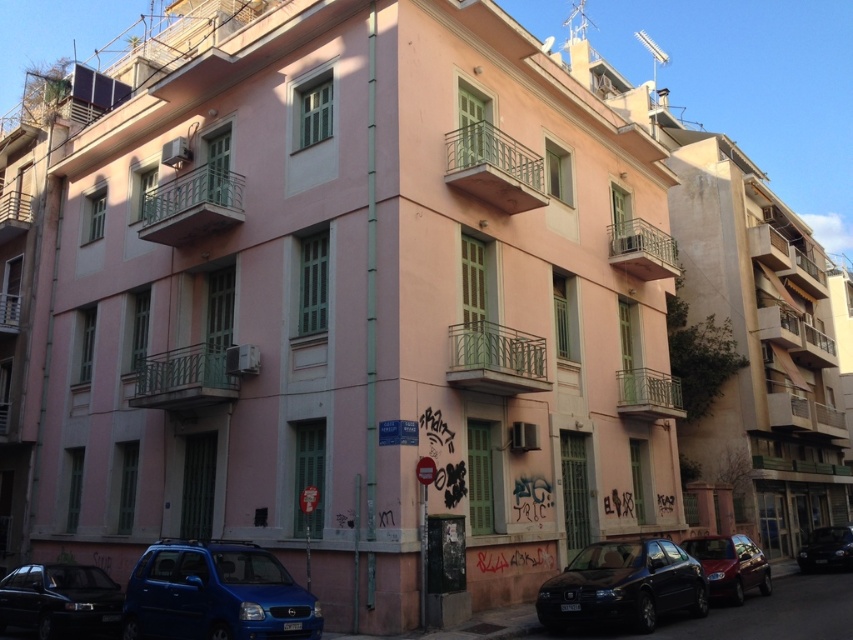
Question: Which is farther from the metallic silver balcony at center-right?

Choices:
 (A) shiny black car at lower right
 (B) metallic green balcony at upper left
 (C) metallic blue hatchback at lower left

Answer: (C)

Question: Is metallic blue hatchback at lower left smaller than green painted metal balcony at upper left?

Choices:
 (A) no
 (B) yes

Answer: (A)

Question: Which point is closer to the camera?

Choices:
 (A) (660, 268)
 (B) (844, 547)
 (C) (532, 372)

Answer: (C)

Question: Which point is farther to the camera?

Choices:
 (A) matte blue sedan at lower left
 (B) shiny red car at lower right
 (C) green metal railing at center

Answer: (B)

Question: Can you confirm if green metal railing at center is thinner than metallic silver balcony at center-right?

Choices:
 (A) no
 (B) yes

Answer: (B)

Question: Is the position of metallic green balcony at upper left more distant than that of shiny red car at lower right?

Choices:
 (A) yes
 (B) no

Answer: (A)